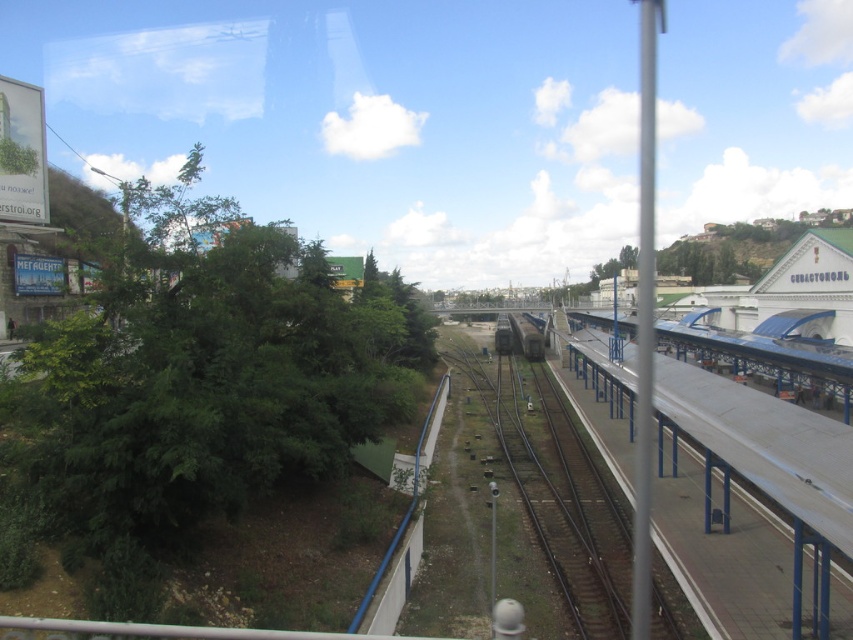
Question: Which point is farther to the camera?

Choices:
 (A) (541, 340)
 (B) (285, 256)

Answer: (A)

Question: Is green leafy tree at left bigger than metallic gray train at center?

Choices:
 (A) no
 (B) yes

Answer: (B)

Question: Which of the following is the farthest from the observer?

Choices:
 (A) green leafy tree at left
 (B) metallic gray train at center

Answer: (B)

Question: Can you confirm if green leafy tree at left is smaller than metallic gray train at center?

Choices:
 (A) yes
 (B) no

Answer: (B)

Question: Among these objects, which one is farthest from the camera?

Choices:
 (A) green leafy tree at left
 (B) metallic gray train at center

Answer: (B)

Question: Is green leafy tree at left further to the viewer compared to metallic gray train at center?

Choices:
 (A) no
 (B) yes

Answer: (A)